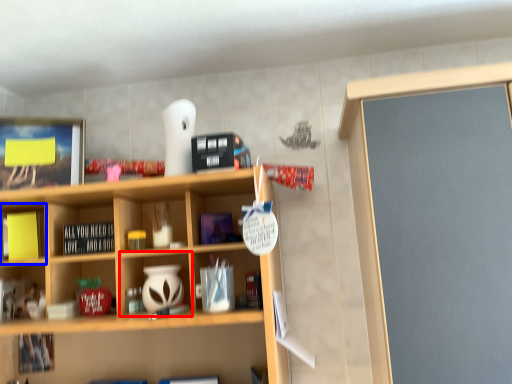
Question: Which object appears closest to the camera in this image, cabinet (highlighted by a red box) or cabinet (highlighted by a blue box)?

Choices:
 (A) cabinet
 (B) cabinet

Answer: (A)